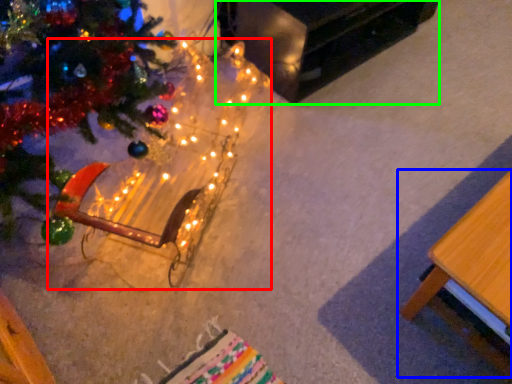
Question: Based on their relative distances, which object is nearer to christmas decoration (highlighted by a red box)? Choose from table (highlighted by a blue box) and table (highlighted by a green box).

Choices:
 (A) table
 (B) table

Answer: (B)